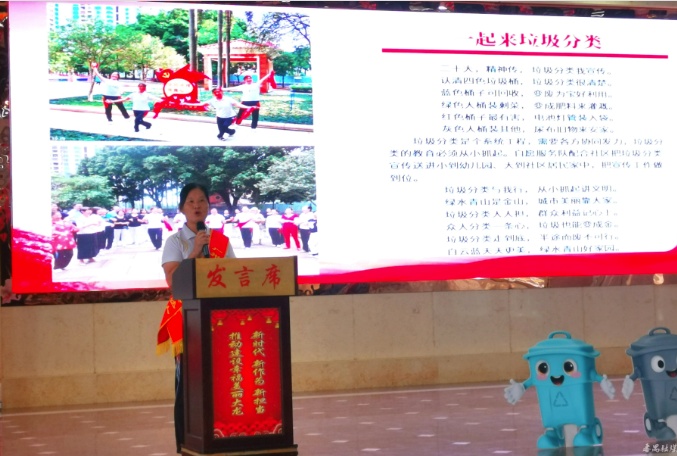
I want to click on gray plastic cartoon trash can, so click(x=654, y=385).